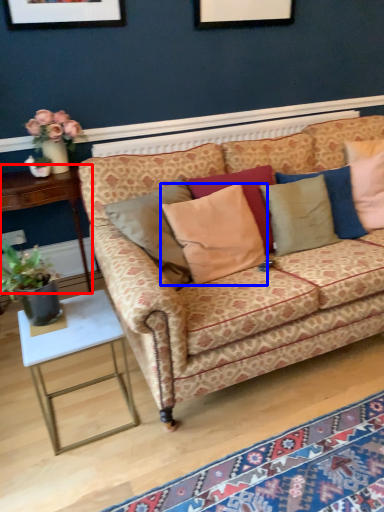
Question: Which object is closer to the camera taking this photo, table (highlighted by a red box) or pillow (highlighted by a blue box)?

Choices:
 (A) table
 (B) pillow

Answer: (B)